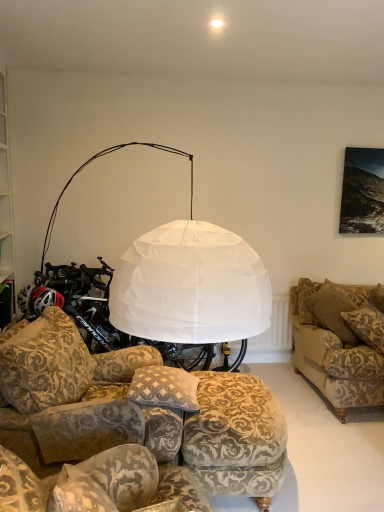
Question: Can you confirm if velvet-patterned couch at right, the 3th studio couch when ordered from front to back, is thinner than patterned fabric footrest at lower center?

Choices:
 (A) yes
 (B) no

Answer: (A)

Question: From the image's perspective, is velvet-patterned couch at right, the 3th studio couch when ordered from front to back, over patterned fabric footrest at lower center?

Choices:
 (A) no
 (B) yes

Answer: (B)

Question: Would you say velvet-patterned couch at right, the 3th studio couch when ordered from left to right, is outside patterned fabric footrest at lower center?

Choices:
 (A) yes
 (B) no

Answer: (A)

Question: Does velvet-patterned couch at right, the 3th studio couch when ordered from front to back, come behind patterned fabric footrest at lower center?

Choices:
 (A) yes
 (B) no

Answer: (A)

Question: Considering the relative sizes of velvet-patterned couch at right, the 3th studio couch when ordered from front to back, and patterned fabric footrest at lower center in the image provided, is velvet-patterned couch at right, the 3th studio couch when ordered from front to back, taller than patterned fabric footrest at lower center?

Choices:
 (A) no
 (B) yes

Answer: (B)

Question: Would you say patterned fabric ottoman at lower center, arranged as the third studio couch when viewed from the back, is inside or outside velvet-patterned couch at right, which is counted as the first studio couch, starting from the right?

Choices:
 (A) inside
 (B) outside

Answer: (B)

Question: Based on their sizes in the image, would you say patterned fabric ottoman at lower center, the second studio couch from the right, is bigger or smaller than velvet-patterned couch at right, which is counted as the first studio couch, starting from the right?

Choices:
 (A) big
 (B) small

Answer: (A)

Question: In terms of width, does patterned fabric ottoman at lower center, the 2th studio couch in the left-to-right sequence, look wider or thinner when compared to velvet-patterned couch at right, which is counted as the first studio couch, starting from the right?

Choices:
 (A) wide
 (B) thin

Answer: (A)

Question: Is point (132, 415) closer or farther from the camera than point (296, 323)?

Choices:
 (A) farther
 (B) closer

Answer: (B)

Question: Is plush beige pillow at lower center spatially inside patterned fabric ottoman at lower center, arranged as the third studio couch when viewed from the back, or outside of it?

Choices:
 (A) inside
 (B) outside

Answer: (B)

Question: Looking at the image, does plush beige pillow at lower center seem bigger or smaller compared to patterned fabric ottoman at lower center, the second studio couch from the right?

Choices:
 (A) big
 (B) small

Answer: (B)

Question: Based on their positions, is plush beige pillow at lower center located to the left or right of patterned fabric ottoman at lower center, the second studio couch from the right?

Choices:
 (A) right
 (B) left

Answer: (A)

Question: Is point (160, 398) closer or farther from the camera than point (86, 395)?

Choices:
 (A) closer
 (B) farther

Answer: (A)

Question: Considering the positions of point 119,433 and point 195,406, is point 119,433 closer or farther from the camera than point 195,406?

Choices:
 (A) farther
 (B) closer

Answer: (B)

Question: Relative to plush beige pillow at lower center, is patterned fabric ottoman at lower center, the 2th studio couch in the left-to-right sequence, in front or behind?

Choices:
 (A) behind
 (B) front

Answer: (B)